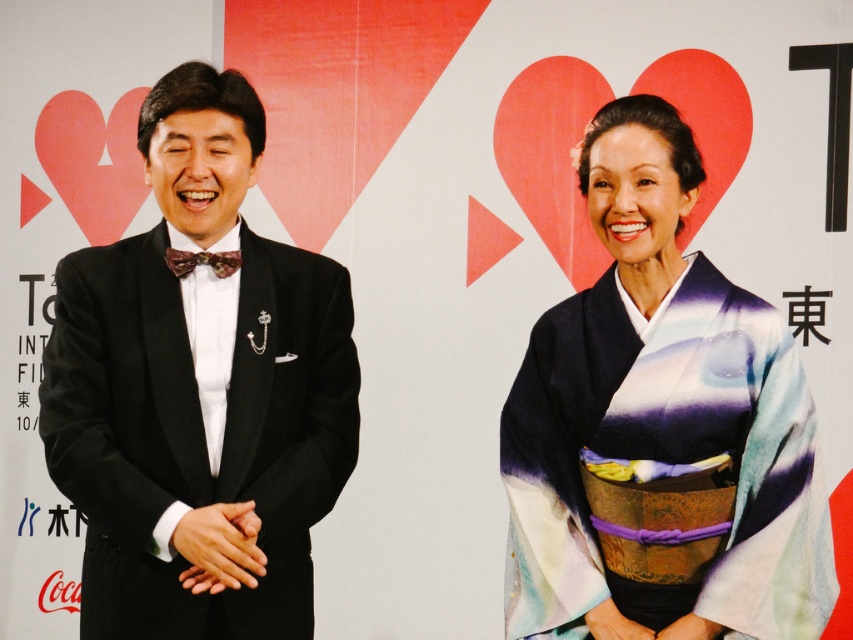
From the picture: You are a photographer positioned at the center of the scene. You need to adjust your camera to focus on the black satin tuxedo at left. Based on its position, which direction should you move your camera to ensure it is centered in your viewfinder?

Since the black satin tuxedo at left is located at point 0.613 on the x and 0.234 on the y coordinate, you should move your camera to the right and up to center it in the viewfinder.

You are standing in front of the image and want to describe the location of the silky kimono at right relative to the person in the tuxedo. Where is it located?

The silky kimono at right is located at point 0.667 on the x axis and 0.775 on the y axis relative to the image frame.

You are a photographer setting up for a group photo. You need to arrange the black satin tuxedo at left and the silky kimono at right so that both subjects are visible in the frame. Considering their heights, which subject should stand closer to the camera to ensure both are equally visible?

The silky kimono at right should stand closer to the camera since the black satin tuxedo at left is taller. This adjustment will help balance their visibility in the photo.